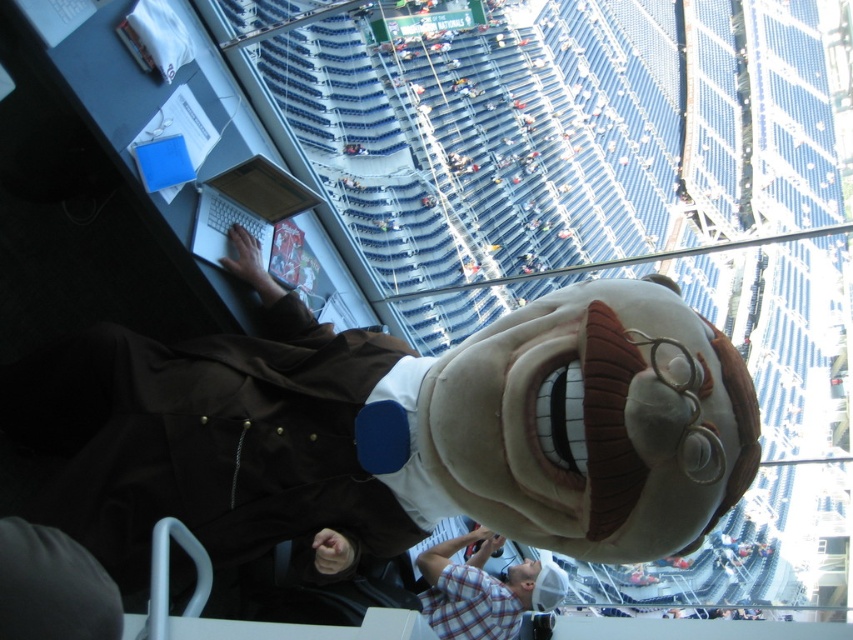
You are a photographer trying to capture a photo of the brown plush mascot at center and the plaid shirt at lower center. Based on their positions, which object is closer to the camera?

The plaid shirt at lower center is closer to the camera because it is at lower center, while the brown plush mascot at center is positioned further back.

Consider the image. You are a photographer positioned at the entrance of the stadium. You need to capture a photo of the brown plush mascot at center without including any of the empty stadium seats in the background. Is the mascot positioned in a location that allows this?

The brown plush mascot at center is located at point (409, 428), which means it is positioned in the central area of the stadium. Since the empty seats are mostly in the background, the mascot can be photographed without including them by adjusting the camera angle to focus on the central area where the mascot is located.